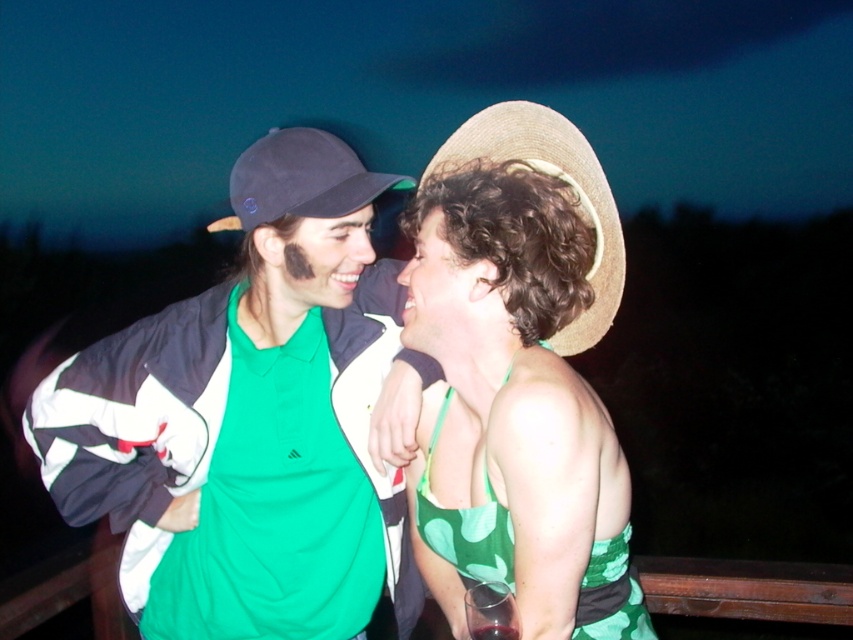
Between point (91, 515) and point (477, 124), which one is positioned behind?

The point (477, 124) is more distant.

Can you confirm if green matte jacket at left is positioned below straw hat at right?

Yes.

Locate an element on the screen. green matte jacket at left is located at coordinates (234, 394).

This screenshot has width=853, height=640. In order to click on green matte jacket at left in this screenshot , I will do pos(234,394).

Does point (376, 595) lie behind point (248, 209)?

That is True.

Which is behind, point (386, 268) or point (218, 225)?

Point (386, 268)

Between point (202, 358) and point (288, 188), which one is positioned behind?

Point (202, 358)

Image resolution: width=853 pixels, height=640 pixels. Identify the location of green matte jacket at left. (234, 394).

Who is taller, green matte jacket at left or green leafy fabric dress at center?

Standing taller between the two is green matte jacket at left.

Who is lower down, green matte jacket at left or green leafy fabric dress at center?

Positioned lower is green matte jacket at left.

Does point (380, 342) lie behind point (584, 264)?

Yes.

The image size is (853, 640). In order to click on green matte jacket at left in this screenshot , I will do `click(234, 394)`.